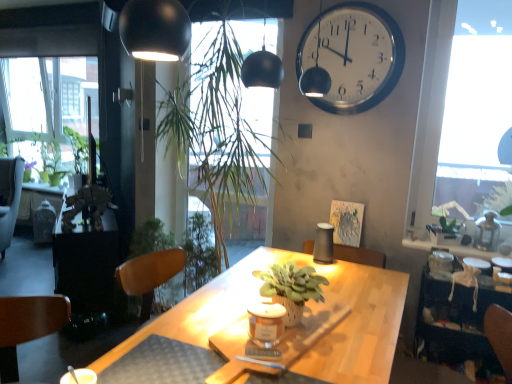
At what (x,y) coordinates should I click in order to perform the action: click on wooden table at right, the second table when ordered from left to right. Please return your answer as a coordinate pair (x, y). The height and width of the screenshot is (384, 512). Looking at the image, I should click on (456, 322).

Describe the element at coordinates (49, 160) in the screenshot. I see `green matte plant at left, arranged as the third plant when viewed from the right` at that location.

What is the approximate height of matte glass candle at center?

It is 4.77 inches.

What is the approximate width of metallic brown table at left, positioned as the 2th table in right-to-left order?

metallic brown table at left, positioned as the 2th table in right-to-left order, is 19.27 inches wide.

At what (x,y) coordinates should I click in order to perform the action: click on velvet brown armchair at left. Please return your answer as a coordinate pair (x, y). The width and height of the screenshot is (512, 384). Looking at the image, I should click on (9, 198).

Can you confirm if metallic brown table at left, the first table positioned from the left, is shorter than green matte plant at center?

No, metallic brown table at left, the first table positioned from the left, is not shorter than green matte plant at center.

From the image's perspective, does metallic brown table at left, which is counted as the 2th table, starting from the front, appear higher than green matte plant at center?

Incorrect, from the image's perspective, metallic brown table at left, which is counted as the 2th table, starting from the front, is lower than green matte plant at center.

Is metallic brown table at left, which is counted as the 2th table, starting from the front, in front of or behind green matte plant at center in the image?

In the image, metallic brown table at left, which is counted as the 2th table, starting from the front, appears behind green matte plant at center.

Is metallic brown table at left, which is counted as the 2th table, starting from the front, facing towards green matte plant at center?

No, metallic brown table at left, which is counted as the 2th table, starting from the front, is not turned towards green matte plant at center.

Considering the sizes of metallic brown table at left, positioned as the 2th table in right-to-left order, and velvet brown armchair at left in the image, is metallic brown table at left, positioned as the 2th table in right-to-left order, bigger or smaller than velvet brown armchair at left?

Clearly, metallic brown table at left, positioned as the 2th table in right-to-left order, is larger in size than velvet brown armchair at left.

Would you say metallic brown table at left, which is counted as the 2th table, starting from the front, is to the left or to the right of velvet brown armchair at left in the picture?

In the image, metallic brown table at left, which is counted as the 2th table, starting from the front, appears on the right side of velvet brown armchair at left.

In order to click on the 1st table to the right when counting from the velvet brown armchair at left in this screenshot , I will do `click(87, 265)`.

Looking at this image, is metallic brown table at left, which is counted as the 2th table, starting from the front, wider than velvet brown armchair at left?

In fact, metallic brown table at left, which is counted as the 2th table, starting from the front, might be narrower than velvet brown armchair at left.

From the image's perspective, does wooden table at right, placed as the first table when sorted from front to back, appear higher than metallic brown table at left, positioned as the 2th table in right-to-left order?

No, from the image's perspective, wooden table at right, placed as the first table when sorted from front to back, is not on top of metallic brown table at left, positioned as the 2th table in right-to-left order.

Is wooden table at right, placed as the first table when sorted from front to back, beside metallic brown table at left, which is the first table in back-to-front order?

No, wooden table at right, placed as the first table when sorted from front to back, is not beside metallic brown table at left, which is the first table in back-to-front order.

Which object is more forward, wooden table at right, the first table when ordered from right to left, or metallic brown table at left, which is counted as the 2th table, starting from the front?

wooden table at right, the first table when ordered from right to left.

From a real-world perspective, relative to metallic brown table at left, which is counted as the 2th table, starting from the front, is wooden table at right, which appears as the second table when viewed from the back, vertically above or below?

In terms of real-world spatial position, wooden table at right, which appears as the second table when viewed from the back, is above metallic brown table at left, which is counted as the 2th table, starting from the front.

Measure the distance between matte glass candle at center and transparent glass window at upper right.

The distance of matte glass candle at center from transparent glass window at upper right is 1.57 meters.

From a real-world perspective, is matte glass candle at center positioned above or below transparent glass window at upper right?

In terms of real-world spatial position, matte glass candle at center is below transparent glass window at upper right.

Is point (258, 311) positioned before point (432, 52)?

Yes.

Locate an element on the screen. Image resolution: width=512 pixels, height=384 pixels. window on the right of matte glass candle at center is located at coordinates click(462, 118).

From a real-world perspective, relative to transparent glass window at upper right, is green leafy plant at center, placed as the second plant when sorted from left to right, vertically above or below?

Clearly, from a real-world perspective, green leafy plant at center, placed as the second plant when sorted from left to right, is below transparent glass window at upper right.

Between green leafy plant at center, acting as the second plant starting from the right, and transparent glass window at upper right, which one is positioned in front?

green leafy plant at center, acting as the second plant starting from the right, is in front.

The image size is (512, 384). In order to click on plant that is the 2nd object to the left of the transparent glass window at upper right, starting at the anchor in this screenshot , I will do `click(220, 121)`.

Is green leafy plant at center, placed as the second plant when sorted from left to right, turned away from transparent glass window at upper right?

That's not correct — green leafy plant at center, placed as the second plant when sorted from left to right, is not looking away from transparent glass window at upper right.

Which plant is the 2nd one when counting from the right side of the wooden desk at center? Please provide its 2D coordinates.

[(451, 225)]

Is wooden desk at center oriented away from green matte plant at upper right, the 3th plant when ordered from left to right?

No, wooden desk at center is not facing the opposite direction of green matte plant at upper right, the 3th plant when ordered from left to right.

From the image's perspective, which is above, wooden desk at center or green matte plant at upper right, the second plant positioned from the front?

From the image's view, green matte plant at upper right, the second plant positioned from the front, is above.

Would you consider wooden desk at center to be distant from green matte plant at upper right, marked as the 1th plant in a right-to-left arrangement?

No, wooden desk at center is not far away from green matte plant at upper right, marked as the 1th plant in a right-to-left arrangement.

Which is in front, matte glass candle at center or green leafy plant at center, arranged as the 3th plant when viewed from the back?

matte glass candle at center.

Can we say matte glass candle at center lies outside green leafy plant at center, the first plant from the front?

Indeed, matte glass candle at center is completely outside green leafy plant at center, the first plant from the front.

Is matte glass candle at center directly adjacent to green leafy plant at center, arranged as the 3th plant when viewed from the back?

No, matte glass candle at center is not making contact with green leafy plant at center, arranged as the 3th plant when viewed from the back.

Between matte glass candle at center and green leafy plant at center, acting as the second plant starting from the right, which one has larger width?

With larger width is green leafy plant at center, acting as the second plant starting from the right.

The height and width of the screenshot is (384, 512). What are the coordinates of `table that is the 2nd one below the green matte plant at center (from a real-world perspective)` in the screenshot? It's located at (87, 265).

Where is `chair above the metallic brown table at left, which is the first table in back-to-front order (from a real-world perspective)`? The height and width of the screenshot is (384, 512). chair above the metallic brown table at left, which is the first table in back-to-front order (from a real-world perspective) is located at coordinates (9, 198).

Consider the image. From the image, which object appears to be nearer to green matte plant at left, placed as the 1th plant when sorted from back to front, velvet brown armchair at left or metallic brown table at left, which is counted as the 2th table, starting from the front?

velvet brown armchair at left lies closer to green matte plant at left, placed as the 1th plant when sorted from back to front, than the other object.

When comparing their distances from wooden table at right, which appears as the second table when viewed from the back, does green matte plant at left, arranged as the third plant when viewed from the right, or white glossy clock at upper right seem further?

Based on the image, green matte plant at left, arranged as the third plant when viewed from the right, appears to be further to wooden table at right, which appears as the second table when viewed from the back.

From the image, which object appears to be farther from green matte plant at left, placed as the 1th plant when sorted from back to front, white glossy clock at upper right or green matte plant at center?

Based on the image, green matte plant at center appears to be further to green matte plant at left, placed as the 1th plant when sorted from back to front.

From the image, which object appears to be farther from wooden desk at center, metallic brown table at left, the first table positioned from the left, or green matte plant at center?

Among the two, metallic brown table at left, the first table positioned from the left, is located further to wooden desk at center.

Estimate the real-world distances between objects in this image. Which object is further from wooden table at right, the second table when ordered from left to right, matte glass candle at center or transparent glass window at upper right?

matte glass candle at center.

Looking at the image, which one is located closer to metallic brown table at left, which is counted as the 2th table, starting from the front, green matte plant at center or matte glass candle at center?

The object closer to metallic brown table at left, which is counted as the 2th table, starting from the front, is green matte plant at center.

Based on their spatial positions, is wooden desk at center or matte glass candle at center closer to green matte plant at left, placed as the 1th plant when sorted from back to front?

wooden desk at center.

Estimate the real-world distances between objects in this image. Which object is closer to metallic brown table at left, which is counted as the 2th table, starting from the front, transparent glass window at upper right or velvet brown armchair at left?

The object closer to metallic brown table at left, which is counted as the 2th table, starting from the front, is velvet brown armchair at left.

Find the location of a particular element. This screenshot has width=512, height=384. clock between green leafy plant at center, arranged as the 3th plant when viewed from the back, and green matte plant at upper right, the second plant positioned from the front, from left to right is located at coordinates (353, 55).

Find the location of a particular element. This screenshot has height=384, width=512. houseplant between matte glass candle at center and green leafy plant at center, arranged as the 3th plant when viewed from the back, in the front-back direction is located at coordinates (291, 288).

What are the coordinates of `desk between metallic brown table at left, positioned as the 2th table in right-to-left order, and wooden table at right, the first table when ordered from right to left, from left to right` in the screenshot? It's located at tap(307, 305).

Find the location of a particular element. The height and width of the screenshot is (384, 512). houseplant situated between green leafy plant at center, placed as the second plant when sorted from left to right, and transparent glass window at upper right from left to right is located at coordinates (291, 288).